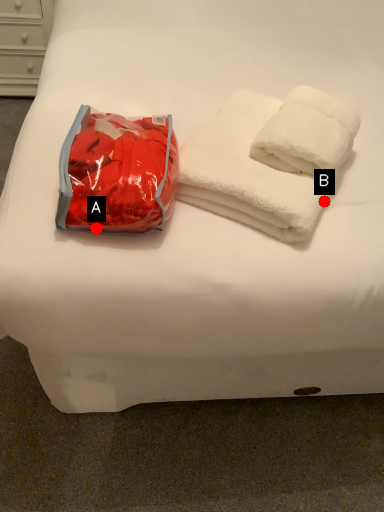
Question: Two points are circled on the image, labeled by A and B beside each circle. Among these points, which one is nearest to the camera?

Choices:
 (A) A is closer
 (B) B is closer

Answer: (A)